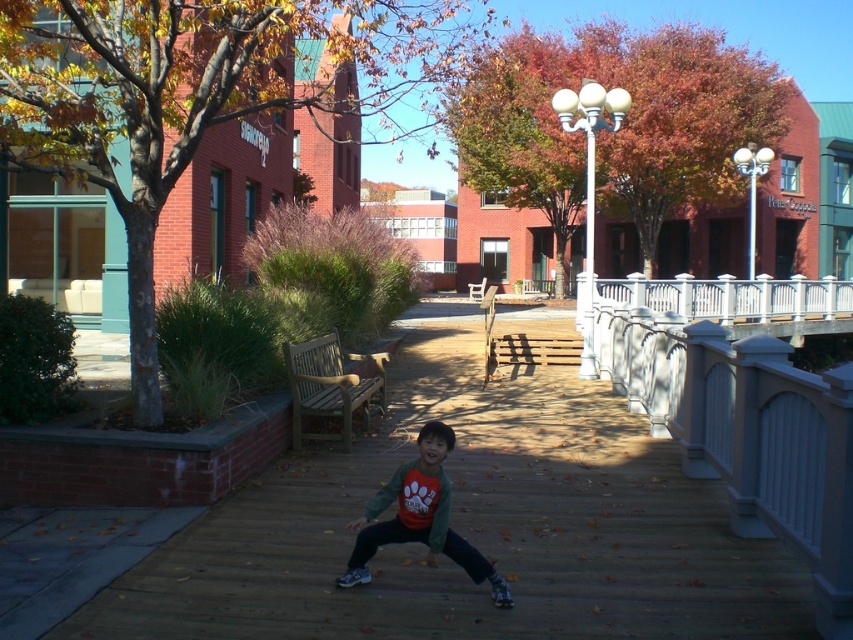
You are standing on the wooden walkway and want to reach the white painted wood railing at right. Based on its coordinates, can you estimate how far it is from the center of the walkway?

The white painted wood railing at right is located at coordinates point (747,433), which means it is positioned to the right and slightly below the center of the walkway. To estimate the distance, you would need to know the total length and width of the walkway. However, based on the coordinates provided, it is closer to the right edge than the center.

You are standing at the point with coordinates point [328,403] and want to walk towards the point with coordinates point [679,284]. Which direction should you move relative to the brick wall?

Since point [679,284] is behind point [328,403], you should move in the direction away from the brick wall to reach it.